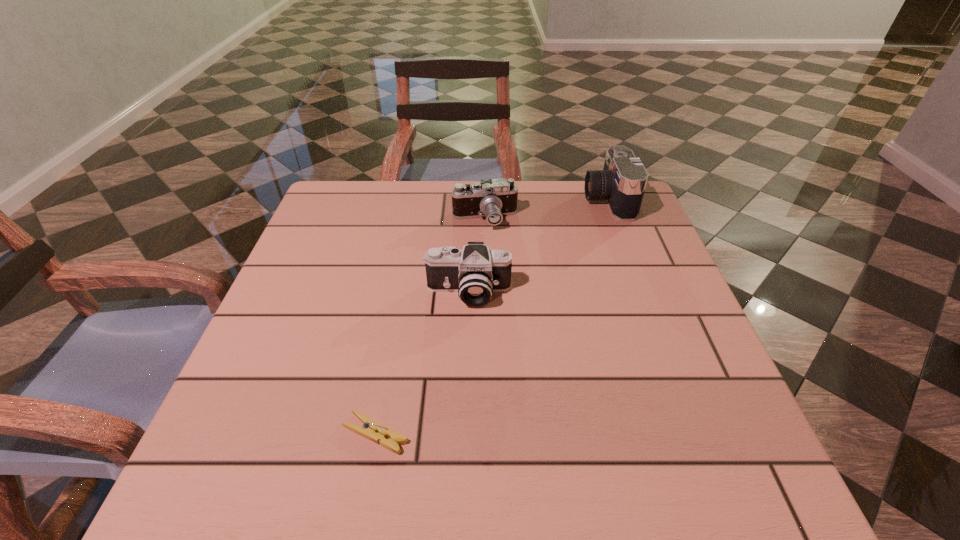
Locate an element on the screen. Image resolution: width=960 pixels, height=540 pixels. vacant space at the far right corner is located at coordinates (583, 179).

You are a GUI agent. You are given a task and a screenshot of the screen. Output one action in this format:
    pyautogui.click(x=<x>, y=<y>)
    Task: Click on the free spot between the clothespin and the nearest camera
    The width and height of the screenshot is (960, 540).
    Given the screenshot: What is the action you would take?
    pyautogui.click(x=421, y=363)

Where is `free spot between the rightmost camera and the second nearest object`? free spot between the rightmost camera and the second nearest object is located at coordinates (538, 246).

Locate an element on the screen. Image resolution: width=960 pixels, height=540 pixels. free space that is in between the rightmost object and the third tallest object is located at coordinates (546, 209).

I want to click on free spot between the nearest object and the third tallest object, so click(430, 326).

I want to click on vacant space that's between the rightmost camera and the shortest object, so click(492, 316).

This screenshot has width=960, height=540. Find the location of `free space between the third tallest object and the shortest object`. free space between the third tallest object and the shortest object is located at coordinates coord(430,326).

The image size is (960, 540). Find the location of `empty space between the rightmost object and the shortest camera`. empty space between the rightmost object and the shortest camera is located at coordinates (546, 209).

At what (x,y) coordinates should I click in order to perform the action: click on free space between the rightmost object and the third farthest object. Please return your answer as a coordinate pair (x, y). Looking at the image, I should click on (538, 246).

Identify the location of empty space that is in between the shortest object and the nearest camera. (421, 363).